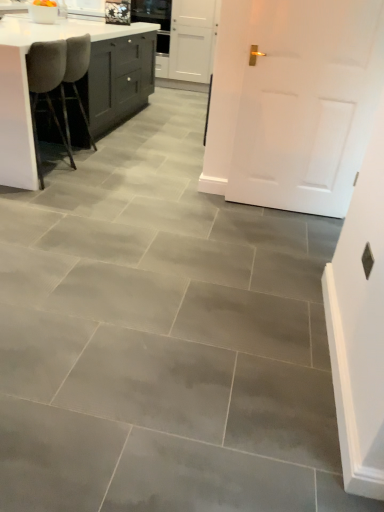
Question: Is gray fabric chair at left, arranged as the 1th chair when viewed from the back, at the right side of white matte door at center?

Choices:
 (A) yes
 (B) no

Answer: (B)

Question: Is white matte door at center a part of gray fabric chair at left, positioned as the second chair in front-to-back order?

Choices:
 (A) no
 (B) yes

Answer: (A)

Question: Does gray fabric chair at left, arranged as the 1th chair when viewed from the back, have a larger size compared to white matte door at center?

Choices:
 (A) no
 (B) yes

Answer: (B)

Question: Is gray fabric chair at left, arranged as the 1th chair when viewed from the back, completely or partially outside of white matte door at center?

Choices:
 (A) yes
 (B) no

Answer: (A)

Question: Can you confirm if gray fabric chair at left, arranged as the 1th chair when viewed from the back, is wider than white matte door at center?

Choices:
 (A) yes
 (B) no

Answer: (A)

Question: Is gray fabric chair at left, arranged as the 1th chair when viewed from the back, facing away from white matte door at center?

Choices:
 (A) yes
 (B) no

Answer: (A)

Question: Is gray fabric chair at left, arranged as the 1th chair when viewed from the back, in contact with white glossy countertop at upper left?

Choices:
 (A) yes
 (B) no

Answer: (B)

Question: Considering the relative positions of gray fabric chair at left, positioned as the second chair in front-to-back order, and white glossy countertop at upper left in the image provided, is gray fabric chair at left, positioned as the second chair in front-to-back order, to the right of white glossy countertop at upper left from the viewer's perspective?

Choices:
 (A) no
 (B) yes

Answer: (B)

Question: Considering the relative positions of gray fabric chair at left, arranged as the 1th chair when viewed from the back, and white glossy countertop at upper left in the image provided, is gray fabric chair at left, arranged as the 1th chair when viewed from the back, in front of white glossy countertop at upper left?

Choices:
 (A) no
 (B) yes

Answer: (A)

Question: Is white glossy countertop at upper left inside gray fabric chair at left, positioned as the second chair in front-to-back order?

Choices:
 (A) yes
 (B) no

Answer: (B)

Question: Considering the relative sizes of gray fabric chair at left, positioned as the second chair in front-to-back order, and white glossy countertop at upper left in the image provided, is gray fabric chair at left, positioned as the second chair in front-to-back order, shorter than white glossy countertop at upper left?

Choices:
 (A) no
 (B) yes

Answer: (A)

Question: Is gray fabric chair at left, arranged as the 1th chair when viewed from the back, positioned far away from white glossy countertop at upper left?

Choices:
 (A) yes
 (B) no

Answer: (B)

Question: Is white matte door at center at the left side of white glossy countertop at upper left?

Choices:
 (A) no
 (B) yes

Answer: (A)